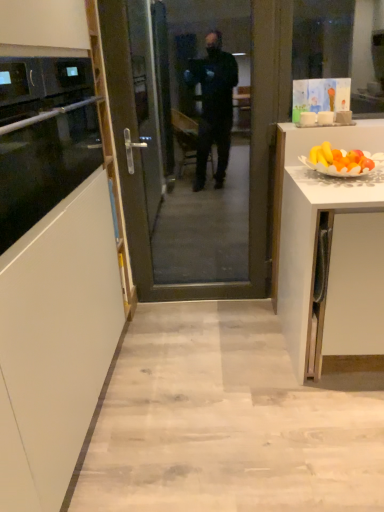
Question: Is transparent glass door at center in front of or behind black glass oven at left in the image?

Choices:
 (A) front
 (B) behind

Answer: (B)

Question: From the image's perspective, is transparent glass door at center located above or below black glass oven at left?

Choices:
 (A) below
 (B) above

Answer: (A)

Question: From a real-world perspective, is transparent glass door at center positioned above or below black glass oven at left?

Choices:
 (A) below
 (B) above

Answer: (A)

Question: Based on their sizes in the image, would you say black glass oven at left is bigger or smaller than transparent glass door at center?

Choices:
 (A) big
 (B) small

Answer: (B)

Question: Is point (89, 80) closer or farther from the camera than point (274, 100)?

Choices:
 (A) closer
 (B) farther

Answer: (A)

Question: From a real-world perspective, is black glass oven at left positioned above or below transparent glass door at center?

Choices:
 (A) above
 (B) below

Answer: (A)

Question: In terms of height, does black glass oven at left look taller or shorter compared to transparent glass door at center?

Choices:
 (A) tall
 (B) short

Answer: (B)